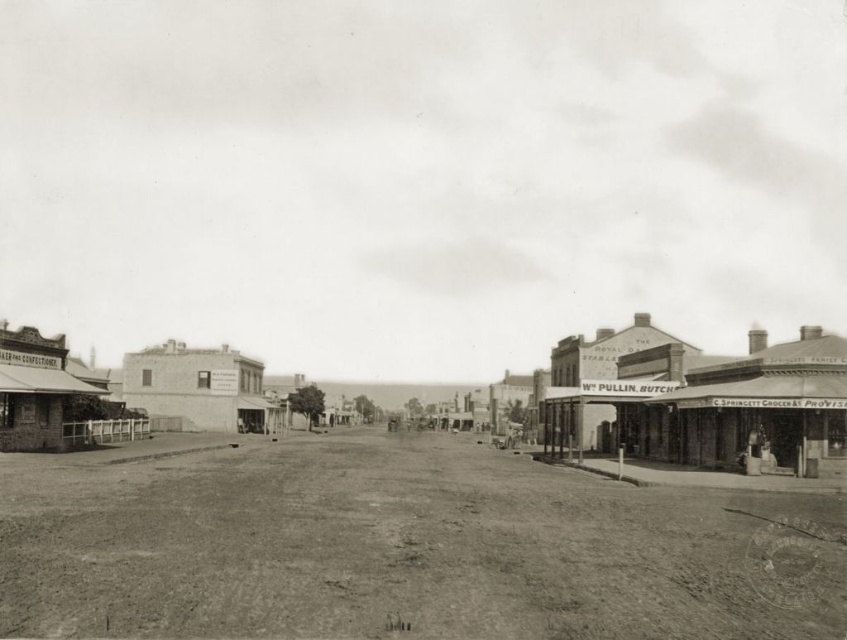
Question: Does dirt track at center appear over smooth concrete street at center?

Choices:
 (A) no
 (B) yes

Answer: (A)

Question: Which point is farther from the camera taking this photo?

Choices:
 (A) (624, 573)
 (B) (628, 353)

Answer: (B)

Question: Does dirt track at center appear over smooth concrete street at center?

Choices:
 (A) yes
 (B) no

Answer: (B)

Question: Does dirt track at center have a lesser width compared to smooth concrete street at center?

Choices:
 (A) no
 (B) yes

Answer: (B)

Question: Which object is closer to the camera taking this photo?

Choices:
 (A) smooth concrete street at center
 (B) dirt track at center

Answer: (B)